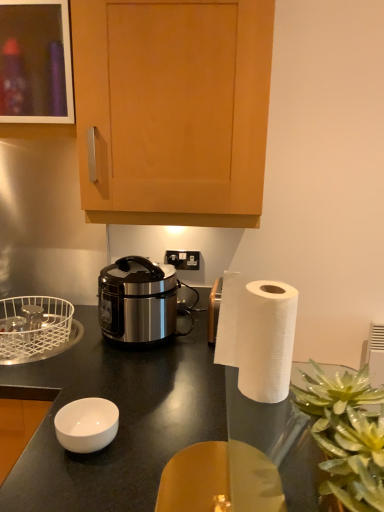
What are the coordinates of `white wire basket at left` in the screenshot? It's located at (33, 328).

How much space does wooden cabinet at upper center, marked as the 2th cabinetry in a left-to-right arrangement, occupy horizontally?

The width of wooden cabinet at upper center, marked as the 2th cabinetry in a left-to-right arrangement, is 38.42 centimeters.

Locate an element on the screen. The height and width of the screenshot is (512, 384). black plastic power outlet at center is located at coordinates (183, 259).

Describe the element at coordinates (87, 424) in the screenshot. I see `white glossy bowl at lower left` at that location.

Image resolution: width=384 pixels, height=512 pixels. I want to click on translucent glass vase at lower right, so click(347, 435).

What is the approximate height of black glossy desk at center?

black glossy desk at center is 36.36 inches tall.

What do you see at coordinates (120, 420) in the screenshot?
I see `black glossy desk at center` at bounding box center [120, 420].

I want to click on white wire basket at left, so click(x=33, y=328).

Is black plastic power outlet at center wider than translucent glass vase at lower right?

No.

From the image's perspective, relative to translucent glass vase at lower right, is black plastic power outlet at center above or below?

Clearly, from the image's perspective, black plastic power outlet at center is above translucent glass vase at lower right.

Does black plastic power outlet at center have a greater height compared to translucent glass vase at lower right?

In fact, black plastic power outlet at center may be shorter than translucent glass vase at lower right.

What are the coordinates of `plant lying on the right of black plastic power outlet at center` in the screenshot? It's located at (347, 435).

From the image's perspective, which object appears higher, translucent glass vase at lower right or stainless steel rice cooker at center?

From the image's view, stainless steel rice cooker at center is above.

Is point (315, 410) in front of point (127, 258)?

Yes, point (315, 410) is closer to viewer.

Considering the sizes of objects translucent glass vase at lower right and stainless steel rice cooker at center in the image provided, who is smaller, translucent glass vase at lower right or stainless steel rice cooker at center?

translucent glass vase at lower right.

Would you say translucent glass vase at lower right is to the left or to the right of stainless steel rice cooker at center in the picture?

Based on their positions, translucent glass vase at lower right is located to the right of stainless steel rice cooker at center.

Looking at their sizes, would you say stainless steel rice cooker at center is wider or thinner than translucent glass vase at lower right?

Clearly, stainless steel rice cooker at center has more width compared to translucent glass vase at lower right.

You are a GUI agent. You are given a task and a screenshot of the screen. Output one action in this format:
    pyautogui.click(x=<x>, y=<y>)
    Task: Click on the plant on the right of stainless steel rice cooker at center
    The height and width of the screenshot is (512, 384).
    Given the screenshot: What is the action you would take?
    click(x=347, y=435)

Is stainless steel rice cooker at center taller or shorter than translucent glass vase at lower right?

Considering their sizes, stainless steel rice cooker at center has more height than translucent glass vase at lower right.

From the image's perspective, is stainless steel rice cooker at center on top of translucent glass vase at lower right?

Correct, stainless steel rice cooker at center appears higher than translucent glass vase at lower right in the image.

Considering the relative positions of black glossy desk at center and wooden cabinet at upper center, marked as the 2th cabinetry in a left-to-right arrangement, in the image provided, is black glossy desk at center behind wooden cabinet at upper center, marked as the 2th cabinetry in a left-to-right arrangement,?

No, it is not.

From a real-world perspective, is black glossy desk at center positioned over wooden cabinet at upper center, which is counted as the first cabinetry, starting from the right, based on gravity?

No, from a real-world perspective, black glossy desk at center is not above wooden cabinet at upper center, which is counted as the first cabinetry, starting from the right.

Does black glossy desk at center have a lesser height compared to wooden cabinet at upper center, marked as the 2th cabinetry in a left-to-right arrangement?

Incorrect, the height of black glossy desk at center does not fall short of that of wooden cabinet at upper center, marked as the 2th cabinetry in a left-to-right arrangement.

How much distance is there between black glossy desk at center and wooden cabinet at upper center, which is counted as the first cabinetry, starting from the right?

26.63 inches.

Can you confirm if matte wood cabinet at upper left, the first cabinetry in the left-to-right sequence, is taller than wooden cabinet at upper center, which is counted as the first cabinetry, starting from the right?

No, matte wood cabinet at upper left, the first cabinetry in the left-to-right sequence, is not taller than wooden cabinet at upper center, which is counted as the first cabinetry, starting from the right.

From the picture: From the image's perspective, is matte wood cabinet at upper left, the first cabinetry in the left-to-right sequence, positioned above or below wooden cabinet at upper center, which is counted as the first cabinetry, starting from the right?

Based on their image positions, matte wood cabinet at upper left, the first cabinetry in the left-to-right sequence, is located above wooden cabinet at upper center, which is counted as the first cabinetry, starting from the right.

At what (x,y) coordinates should I click in order to perform the action: click on cabinetry lying in front of the matte wood cabinet at upper left, the 2th cabinetry viewed from the right. Please return your answer as a coordinate pair (x, y). The height and width of the screenshot is (512, 384). Looking at the image, I should click on (173, 109).

Is black plastic power outlet at center positioned with its back to matte wood cabinet at upper left, the 2th cabinetry viewed from the right?

black plastic power outlet at center is not turned away from matte wood cabinet at upper left, the 2th cabinetry viewed from the right.

Based on their positions, is black plastic power outlet at center located to the left or right of matte wood cabinet at upper left, the first cabinetry in the left-to-right sequence?

Based on their positions, black plastic power outlet at center is located to the right of matte wood cabinet at upper left, the first cabinetry in the left-to-right sequence.

Considering their positions, is black plastic power outlet at center located in front of or behind matte wood cabinet at upper left, the 2th cabinetry viewed from the right?

black plastic power outlet at center is behind matte wood cabinet at upper left, the 2th cabinetry viewed from the right.

Between black plastic power outlet at center and matte wood cabinet at upper left, the first cabinetry in the left-to-right sequence, which one has larger width?

With larger width is matte wood cabinet at upper left, the first cabinetry in the left-to-right sequence.

From a real-world perspective, is black plastic power outlet at center physically located above or below black glossy desk at center?

In terms of real-world spatial position, black plastic power outlet at center is above black glossy desk at center.

Based on the photo, from the image's perspective, is black plastic power outlet at center above black glossy desk at center?

Correct, black plastic power outlet at center appears higher than black glossy desk at center in the image.

Considering the relative positions of black plastic power outlet at center and black glossy desk at center in the image provided, is black plastic power outlet at center to the left or to the right of black glossy desk at center?

black plastic power outlet at center is to the right of black glossy desk at center.

Would you say black plastic power outlet at center is inside or outside black glossy desk at center?

black plastic power outlet at center is not inside black glossy desk at center, it's outside.

This screenshot has height=512, width=384. I want to click on power outlet behind the translucent glass vase at lower right, so click(183, 259).

The height and width of the screenshot is (512, 384). Identify the location of rice cooker below the translucent glass vase at lower right (from a real-world perspective). (138, 301).

From the image, which object appears to be farther from translucent glass vase at lower right, matte wood cabinet at upper left, the first cabinetry in the left-to-right sequence, or wooden cabinet at upper center, which is counted as the first cabinetry, starting from the right?

Among the two, matte wood cabinet at upper left, the first cabinetry in the left-to-right sequence, is located further to translucent glass vase at lower right.

When comparing their distances from white glossy bowl at lower left, does black plastic power outlet at center or white wire basket at left seem further?

Based on the image, black plastic power outlet at center appears to be further to white glossy bowl at lower left.

When comparing their distances from translucent glass vase at lower right, does stainless steel rice cooker at center or white wire basket at left seem further?

white wire basket at left.

Looking at the image, which one is located further to black plastic power outlet at center, matte wood cabinet at upper left, the first cabinetry in the left-to-right sequence, or translucent glass vase at lower right?

translucent glass vase at lower right lies further to black plastic power outlet at center than the other object.

When comparing their distances from white wire basket at left, does stainless steel rice cooker at center or translucent glass vase at lower right seem further?

Among the two, translucent glass vase at lower right is located further to white wire basket at left.

When comparing their distances from stainless steel rice cooker at center, does translucent glass vase at lower right or matte wood cabinet at upper left, the first cabinetry in the left-to-right sequence, seem closer?

matte wood cabinet at upper left, the first cabinetry in the left-to-right sequence, is positioned closer to the anchor stainless steel rice cooker at center.

Based on the photo, from the image, which object appears to be farther from translucent glass vase at lower right, stainless steel rice cooker at center or white glossy bowl at lower left?

The object further to translucent glass vase at lower right is stainless steel rice cooker at center.

From the image, which object appears to be nearer to black plastic power outlet at center, white wire basket at left or white glossy bowl at lower left?

The object closer to black plastic power outlet at center is white wire basket at left.

This screenshot has width=384, height=512. In order to click on power outlet between wooden cabinet at upper center, marked as the 2th cabinetry in a left-to-right arrangement, and stainless steel rice cooker at center, in the vertical direction in this screenshot , I will do `click(183, 259)`.

You are a GUI agent. You are given a task and a screenshot of the screen. Output one action in this format:
    pyautogui.click(x=<x>, y=<y>)
    Task: Click on the rice cooker between white wire basket at left and black plastic power outlet at center in the horizontal direction
    
    Given the screenshot: What is the action you would take?
    pyautogui.click(x=138, y=301)

Locate an element on the screen. desk between translucent glass vase at lower right and black plastic power outlet at center from front to back is located at coordinates point(120,420).

Where is `rice cooker that lies between matte wood cabinet at upper left, the first cabinetry in the left-to-right sequence, and black glossy desk at center from top to bottom`? rice cooker that lies between matte wood cabinet at upper left, the first cabinetry in the left-to-right sequence, and black glossy desk at center from top to bottom is located at coordinates (138, 301).